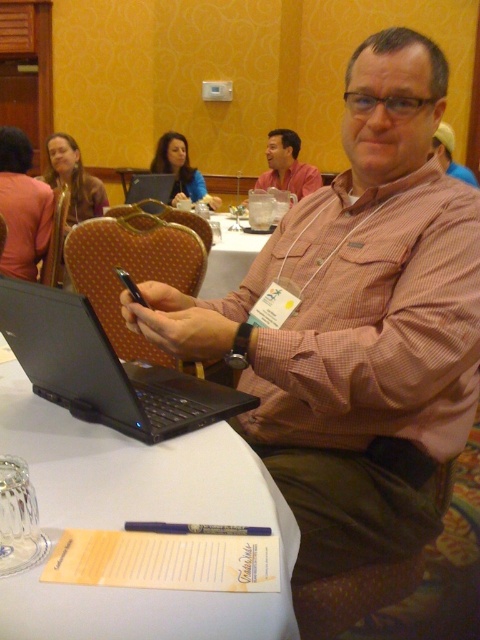
You are organizing a meeting and need to place a new folder on the table. The folder is the same size as the white paper at center. Where should you place it so it doesn not block the matte pink shirt at upper left?

Since the white paper at center has a smaller size compared to matte pink shirt at upper left, placing the folder next to the white paper at center would avoid blocking the larger matte pink shirt at upper left.

You are standing in the conference room and want to determine which of the two points, point (274, 150) or point (180, 145), is closer to you. Can you figure it out?

Point (274, 150) is further to the viewer than point (180, 145), so point (180, 145) is closer to you.